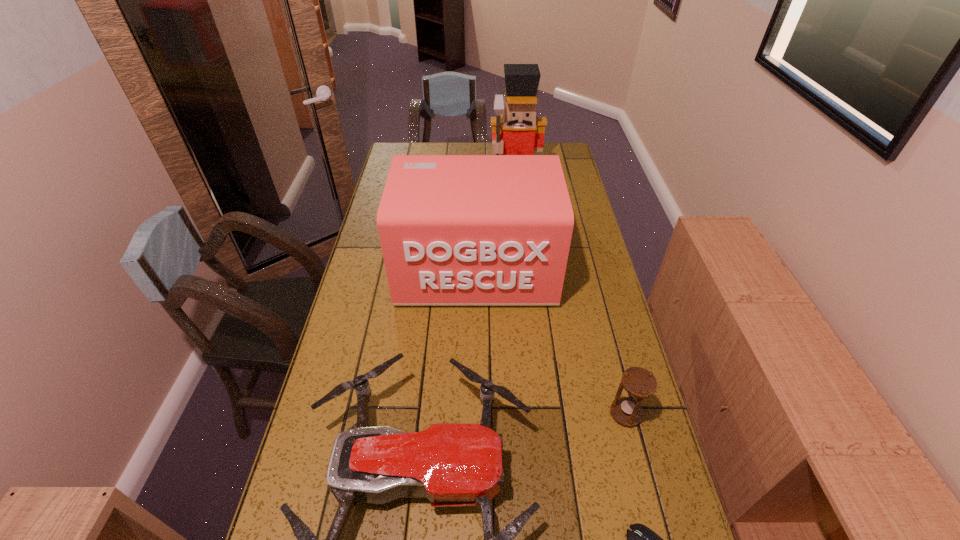
Locate an element on the screen. This screenshot has height=540, width=960. hourglass at the right edge is located at coordinates (639, 383).

In order to click on vacant space at the left edge of the desktop in this screenshot , I will do `click(332, 345)`.

You are a GUI agent. You are given a task and a screenshot of the screen. Output one action in this format:
    pyautogui.click(x=<x>, y=<y>)
    Task: Click on the vacant region at the right edge of the desktop
    Image resolution: width=960 pixels, height=540 pixels.
    Given the screenshot: What is the action you would take?
    pyautogui.click(x=583, y=404)

Image resolution: width=960 pixels, height=540 pixels. What are the coordinates of `blank space at the far left corner` in the screenshot? It's located at (398, 143).

Find the location of a particular element. free space at the far right corner is located at coordinates (559, 144).

Where is `free area in between the third shortest object and the tallest object`? The height and width of the screenshot is (540, 960). free area in between the third shortest object and the tallest object is located at coordinates (570, 299).

Locate which object ranks second in proximity to the hourglass. Please provide its 2D coordinates. Your answer should be formatted as a tuple, i.e. [(x, y)], where the tuple contains the x and y coordinates of a point satisfying the conditions above.

[(641, 539)]

The height and width of the screenshot is (540, 960). Find the location of `object that ranks as the fourth closest to the shortest object`. object that ranks as the fourth closest to the shortest object is located at coordinates (518, 131).

Identify the location of vacant area in the image that satisfies the following two spatial constraints: 1. in front of the farthest object holding the staff; 2. on the left side of the third shortest object. (540, 414).

This screenshot has height=540, width=960. I want to click on free space in the image that satisfies the following two spatial constraints: 1. on the surface of the third tallest object where the text is embossed; 2. on the left side of the fourth nearest object, so click(x=475, y=414).